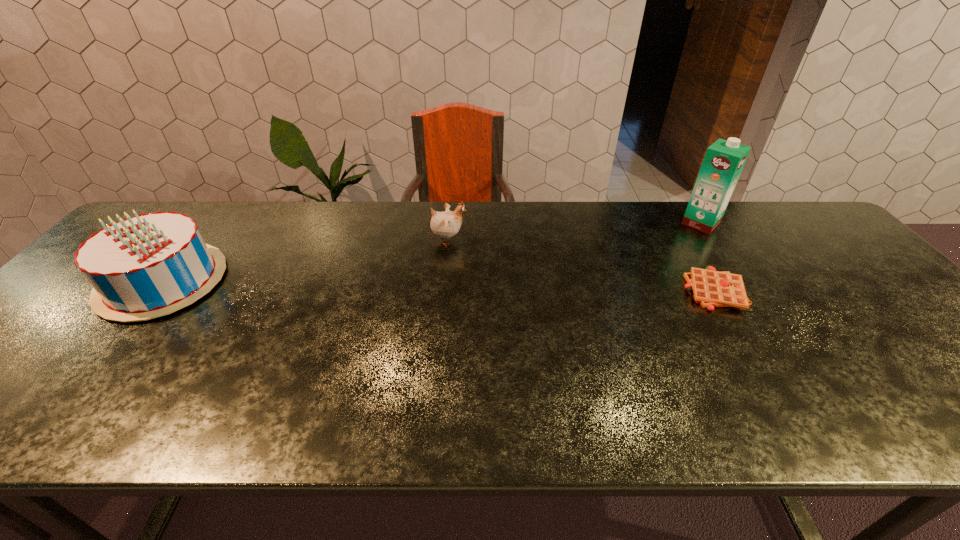
Image resolution: width=960 pixels, height=540 pixels. What are the coordinates of `vacant area that lies between the leftmost object and the bird` in the screenshot? It's located at (305, 261).

Where is `vacant area that lies between the shortest object and the tallest object`? Image resolution: width=960 pixels, height=540 pixels. vacant area that lies between the shortest object and the tallest object is located at coordinates (708, 257).

At what (x,y) coordinates should I click in order to perform the action: click on unoccupied area between the shortest object and the carton. Please return your answer as a coordinate pair (x, y). This screenshot has height=540, width=960. Looking at the image, I should click on (708, 257).

Locate an element on the screen. The height and width of the screenshot is (540, 960). free space between the birthday cake and the tallest object is located at coordinates (432, 252).

This screenshot has width=960, height=540. In order to click on vacant space that's between the shortest object and the carton in this screenshot , I will do `click(708, 257)`.

Identify the location of vacant area that lies between the third tallest object and the carton. (574, 232).

Where is `empty space that is in between the shortest object and the second object from left to right`? Image resolution: width=960 pixels, height=540 pixels. empty space that is in between the shortest object and the second object from left to right is located at coordinates (581, 266).

In order to click on unoccupied area between the leftmost object and the carton in this screenshot , I will do `click(432, 252)`.

Locate which object ranks third in proximity to the second tallest object. Please provide its 2D coordinates. Your answer should be formatted as a tuple, i.e. [(x, y)], where the tuple contains the x and y coordinates of a point satisfying the conditions above.

[(724, 160)]

Locate which object is the second closest to the tallest object. Please provide its 2D coordinates. Your answer should be formatted as a tuple, i.e. [(x, y)], where the tuple contains the x and y coordinates of a point satisfying the conditions above.

[(444, 225)]